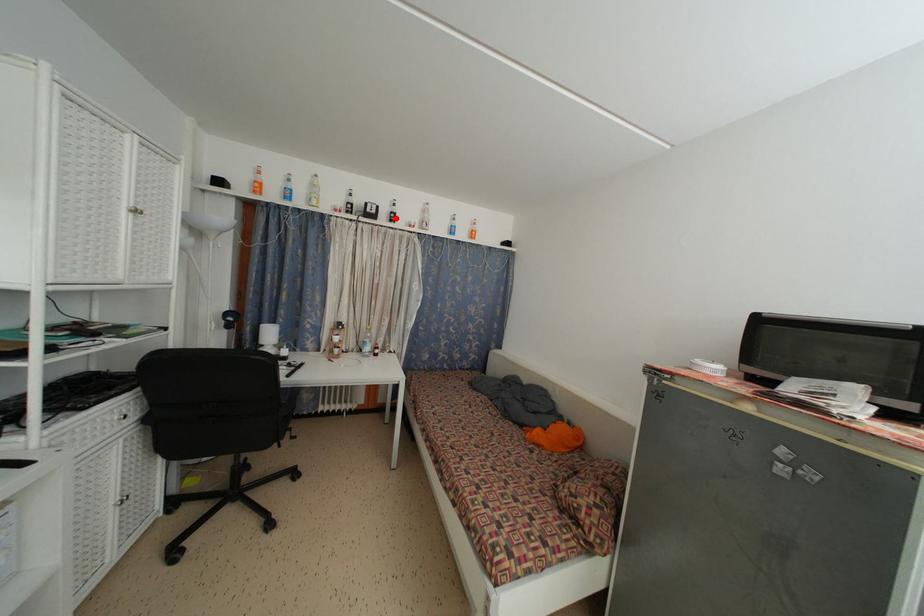
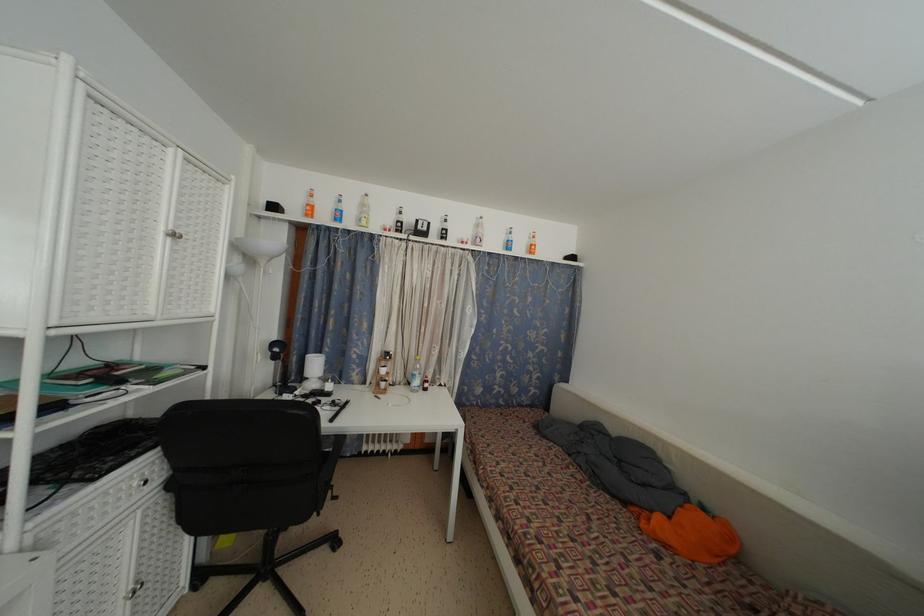
In the second image, find the point that corresponds to the highlighted location in the first image.

(446, 235)